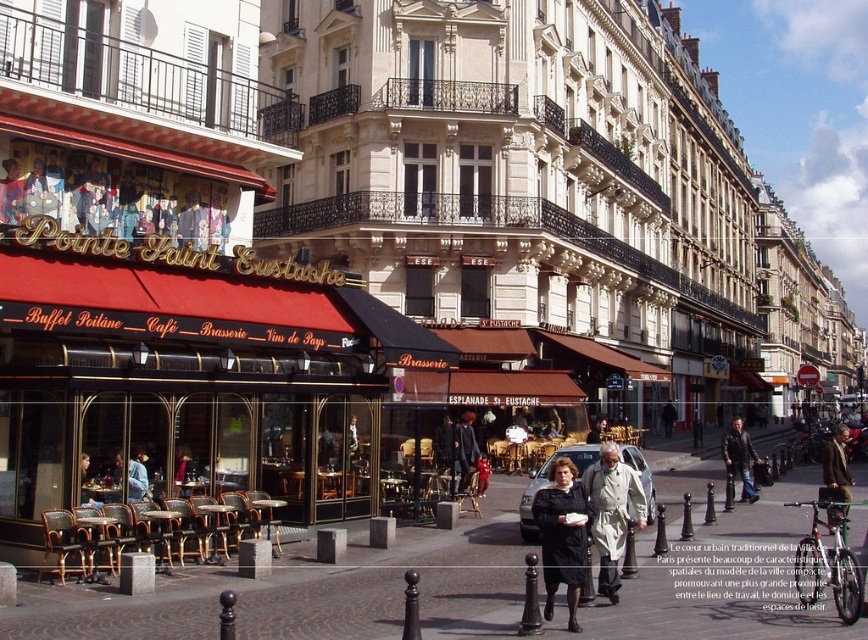
Is light beige trench coat at center smaller than leather jacket at center?

Indeed, light beige trench coat at center has a smaller size compared to leather jacket at center.

Is light beige trench coat at center positioned behind leather jacket at center?

No.

Based on the photo, who is more forward, (612,483) or (755,456)?

Point (612,483)

The image size is (868, 640). I want to click on light beige trench coat at center, so pyautogui.click(x=610, y=513).

Can you confirm if light beige trench coat at center is thinner than brown leather jacket at center-right?

Correct, light beige trench coat at center's width is less than brown leather jacket at center-right's.

The image size is (868, 640). I want to click on light beige trench coat at center, so click(610, 513).

Between light beige trench coat at center and black leather jacket at center, which one is positioned higher?

light beige trench coat at center

Does light beige trench coat at center come in front of black leather jacket at center?

Yes, it is.

The width and height of the screenshot is (868, 640). What are the coordinates of `light beige trench coat at center` in the screenshot? It's located at (610, 513).

At what (x,y) coordinates should I click in order to perform the action: click on light beige trench coat at center. Please return your answer as a coordinate pair (x, y). Looking at the image, I should click on (610, 513).